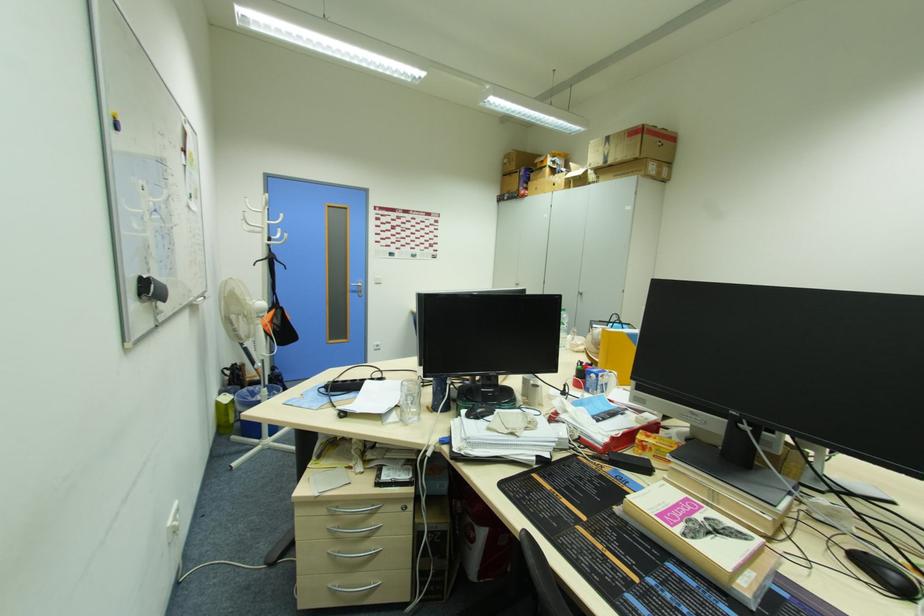
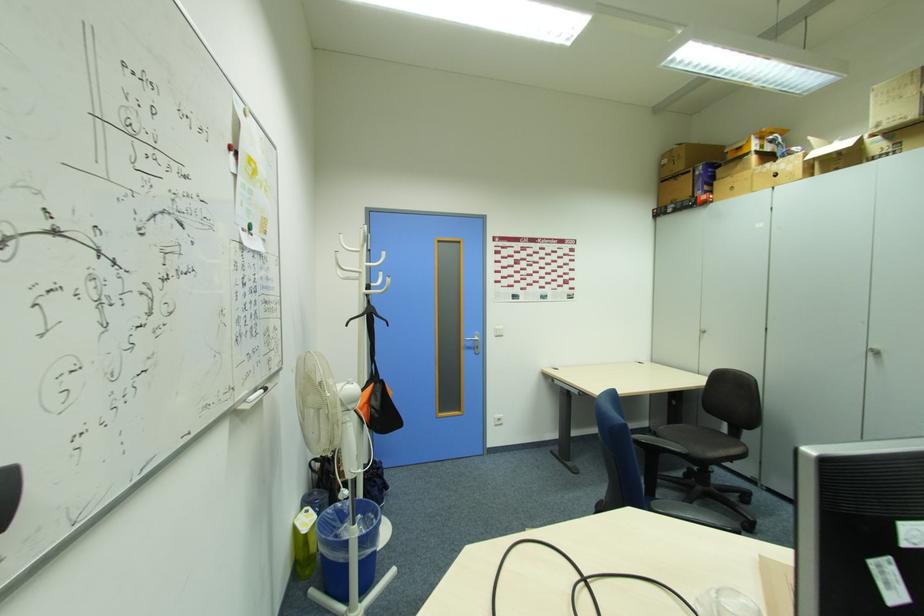
In the second image, find the point that corresponds to the point at 358,291 in the first image.

(472, 346)